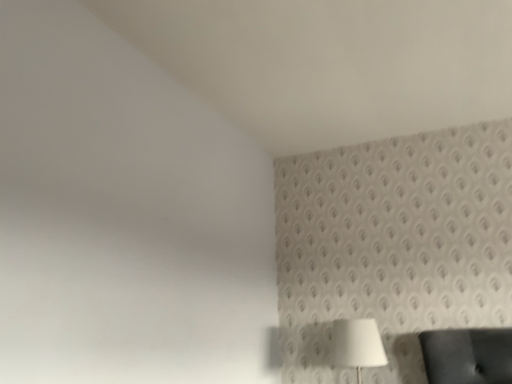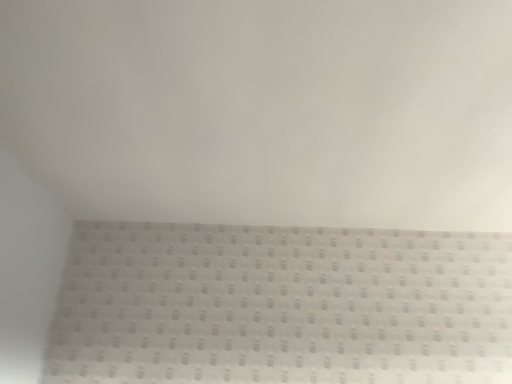
Question: Which way did the camera rotate in the video?

Choices:
 (A) rotated downward
 (B) rotated upward

Answer: (B)